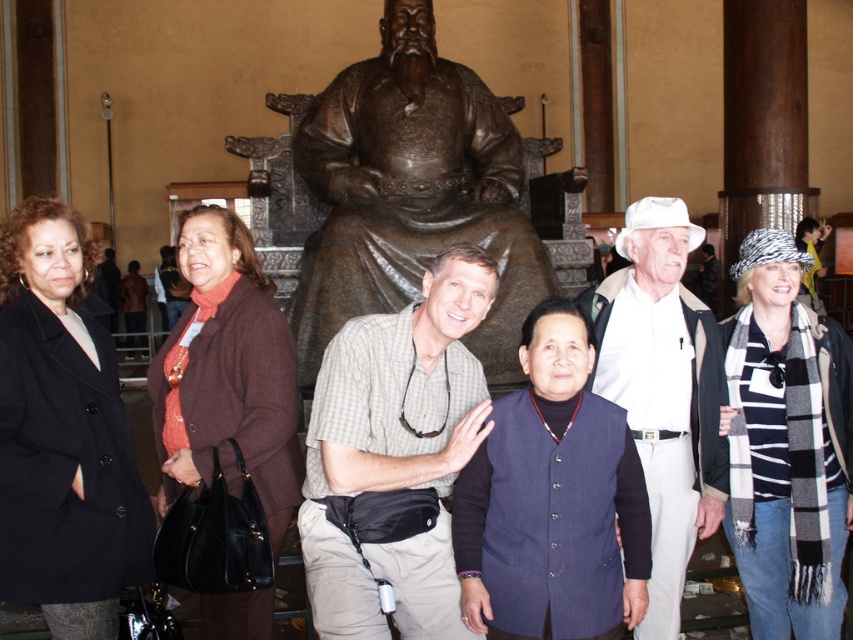
Is bronze statue at center positioned at the back of white cotton hat at center?

That is True.

Does bronze statue at center appear under white cotton hat at center?

Actually, bronze statue at center is above white cotton hat at center.

Is point (427, 61) positioned before point (718, 401)?

No, it is behind (718, 401).

Find the location of a particular element. bronze statue at center is located at coordinates (410, 193).

Is bronze statue at center to the right of checkered fabric shirt at center from the viewer's perspective?

No, bronze statue at center is not to the right of checkered fabric shirt at center.

Where is `bronze statue at center`? Image resolution: width=853 pixels, height=640 pixels. bronze statue at center is located at coordinates (410, 193).

Is checkered fabric shirt at center shorter than white cotton hat at center?

Yes, checkered fabric shirt at center is shorter than white cotton hat at center.

Does checkered fabric shirt at center have a larger size compared to white cotton hat at center?

Actually, checkered fabric shirt at center might be smaller than white cotton hat at center.

Identify the location of checkered fabric shirt at center. (396, 451).